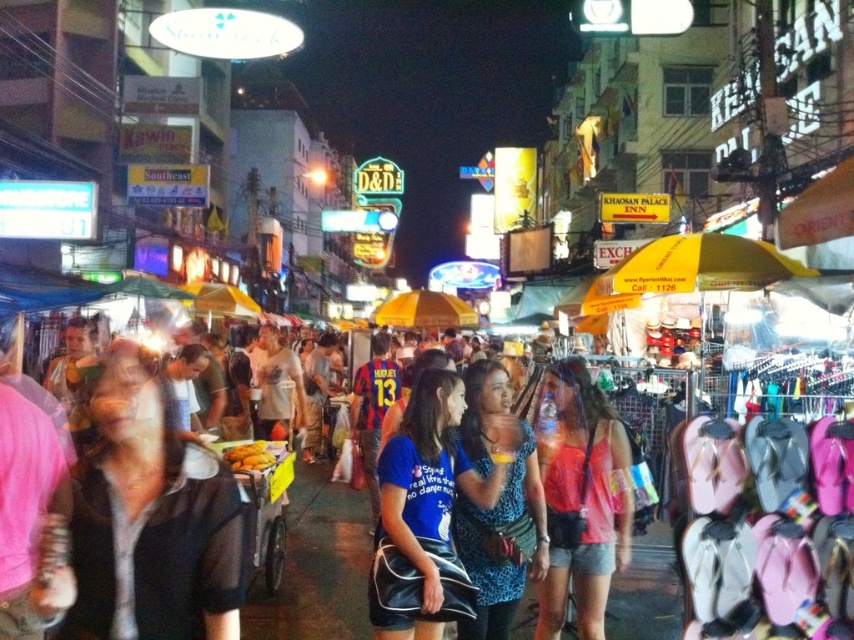
In order to click on matte pink tank top at center in this screenshot , I will do `click(582, 500)`.

Who is positioned more to the left, matte pink tank top at center or yellow fabric umbrella at center?

yellow fabric umbrella at center is more to the left.

Does point (563, 490) come farther from viewer compared to point (427, 323)?

No, it is in front of (427, 323).

What are the coordinates of `matte pink tank top at center` in the screenshot? It's located at (582, 500).

Can you confirm if blue printed dress at center is positioned above yellow fabric umbrella at center?

Incorrect, blue printed dress at center is not positioned above yellow fabric umbrella at center.

Between blue printed dress at center and yellow fabric umbrella at center, which one has less height?

With less height is yellow fabric umbrella at center.

Where is `blue printed dress at center`? blue printed dress at center is located at coordinates (502, 544).

The image size is (854, 640). What do you see at coordinates (582, 500) in the screenshot? I see `matte pink tank top at center` at bounding box center [582, 500].

Can you confirm if matte pink tank top at center is shorter than blue printed dress at center?

Incorrect, matte pink tank top at center's height does not fall short of blue printed dress at center's.

Is point (560, 488) positioned in front of point (474, 636)?

No.

This screenshot has width=854, height=640. I want to click on matte pink tank top at center, so click(582, 500).